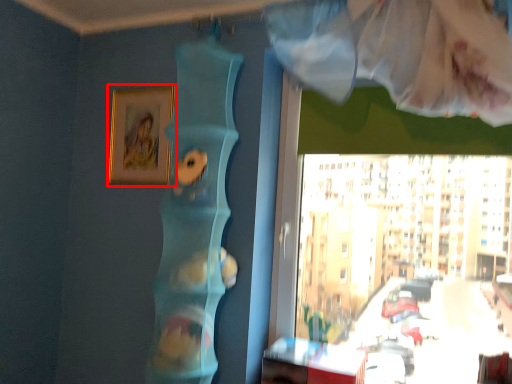
Question: From the image's perspective, where is picture frame (annotated by the red box) located in relation to table in the image?

Choices:
 (A) below
 (B) above

Answer: (B)